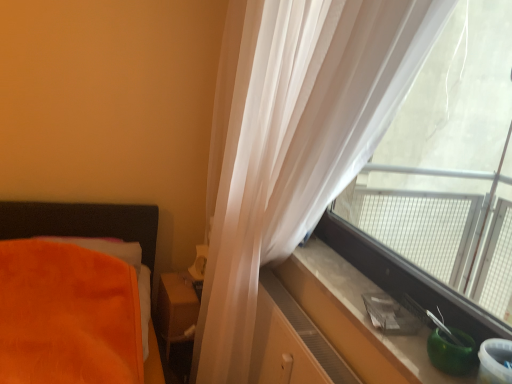
The width and height of the screenshot is (512, 384). In order to click on blank area beneath transparent plastic window at right (from a real-world perspective) in this screenshot , I will do `click(367, 279)`.